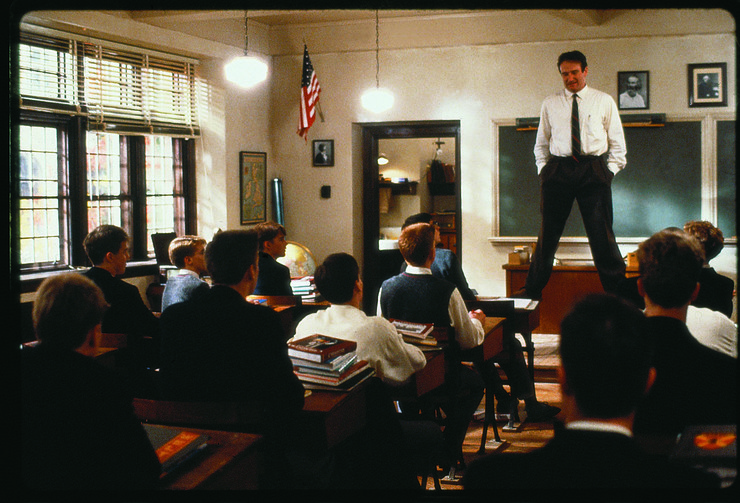
I want to click on corners of chalkboards, so click(505, 234), click(500, 131), click(695, 123), click(718, 123), click(722, 232).